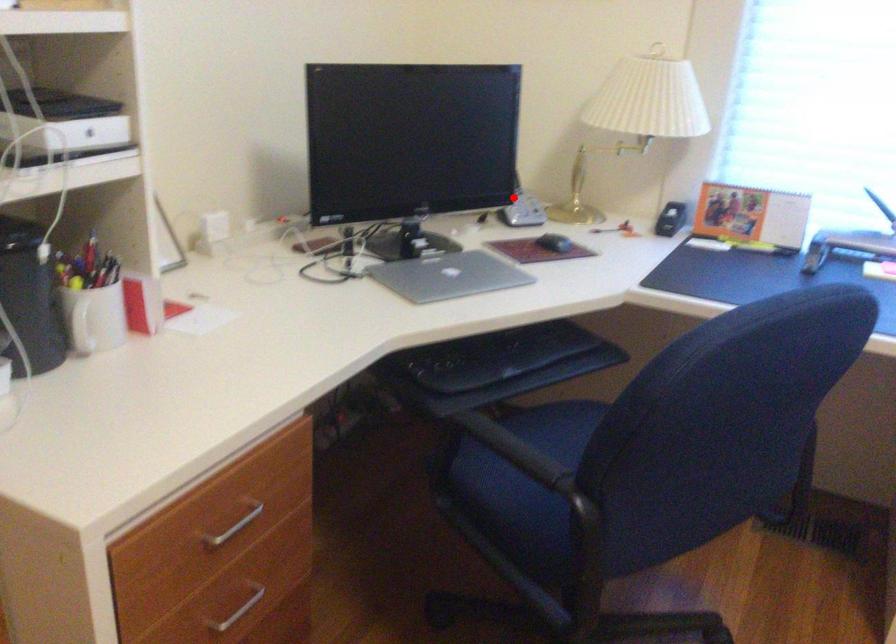
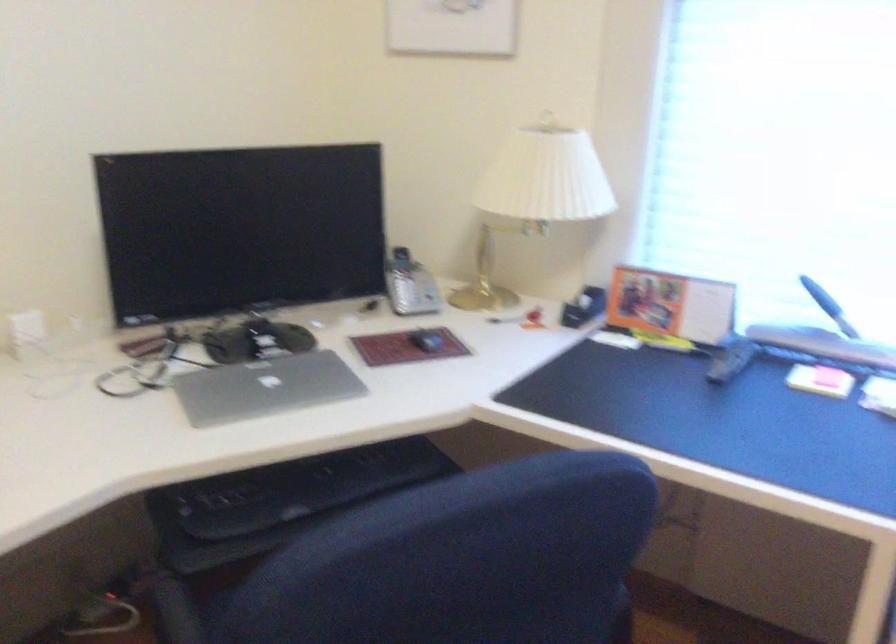
Question: I am providing you with two images of the same scene from different viewpoints. Given a red point in image1, look at the same physical point in image2. Is it:

Choices:
 (A) Closer to the viewpoint
 (B) Farther from the viewpoint

Answer: (A)